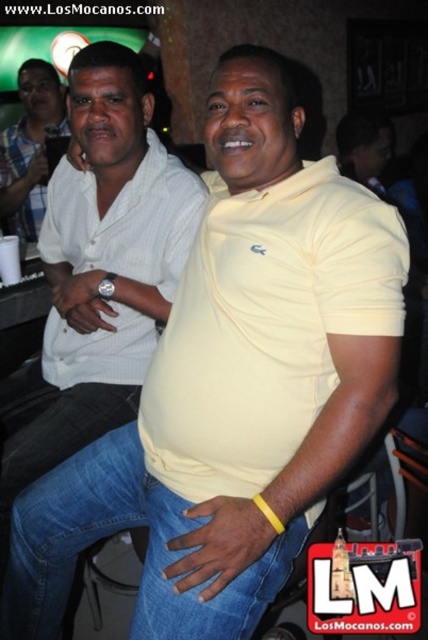
Question: In this image, where is white matte shirt at center located relative to matte white shirt at left?

Choices:
 (A) above
 (B) below

Answer: (B)

Question: Which object appears farthest from the camera in this image?

Choices:
 (A) blue denim jeans at center
 (B) matte white shirt at left
 (C) white matte shirt at center

Answer: (B)

Question: Which point appears closest to the camera in this image?

Choices:
 (A) (50, 621)
 (B) (41, 161)

Answer: (A)

Question: Which of the following is the closest to the observer?

Choices:
 (A) matte white shirt at left
 (B) white matte shirt at center

Answer: (B)

Question: Can you confirm if white matte shirt at center is bigger than matte white shirt at left?

Choices:
 (A) no
 (B) yes

Answer: (B)

Question: Can you confirm if white matte shirt at center is thinner than matte white shirt at left?

Choices:
 (A) yes
 (B) no

Answer: (B)